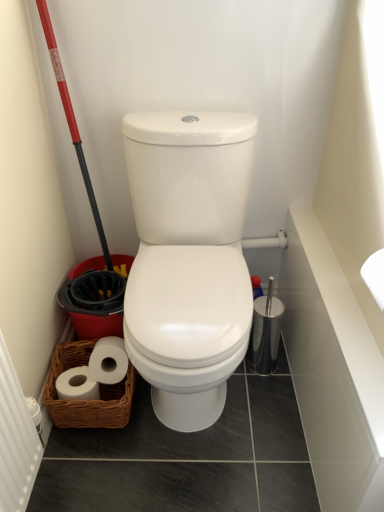
At what (x,y) coordinates should I click in order to perform the action: click on white matte toilet paper at center. Please return your answer as a coordinate pair (x, y). Looking at the image, I should click on (375, 276).

Describe the element at coordinates (375, 276) in the screenshot. I see `white matte toilet paper at center` at that location.

Where is `white matte toilet paper at center`? The width and height of the screenshot is (384, 512). white matte toilet paper at center is located at coordinates (375, 276).